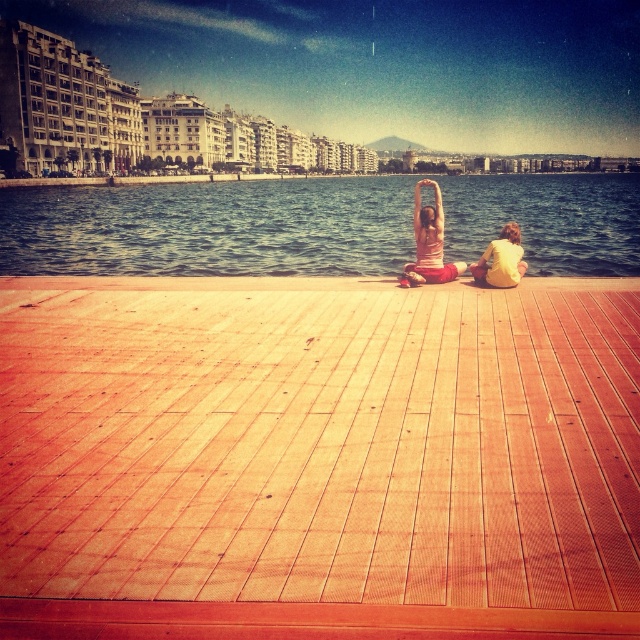
Does blue water at center come behind pink fabric at center?

That is True.

Can you confirm if blue water at center is shorter than pink fabric at center?

Incorrect, blue water at center's height does not fall short of pink fabric at center's.

Is point (3, 260) closer to camera compared to point (432, 208)?

No, (3, 260) is further to viewer.

Identify the location of blue water at center. (211, 228).

Is wooden at center closer to the viewer compared to blue water at center?

Yes, it is.

Which is behind, point (129, 339) or point (609, 218)?

Point (609, 218)

Does point (132, 520) come closer to viewer compared to point (300, 236)?

Yes, point (132, 520) is in front of point (300, 236).

Identify the location of wooden at center. (317, 458).

Measure the distance from wooden at center to yellow cotton shirt at lower right.

They are 21.58 meters apart.

Between wooden at center and yellow cotton shirt at lower right, which one has more height?

wooden at center

Which is in front, point (502, 348) or point (490, 248)?

Point (502, 348)

This screenshot has height=640, width=640. I want to click on wooden at center, so click(x=317, y=458).